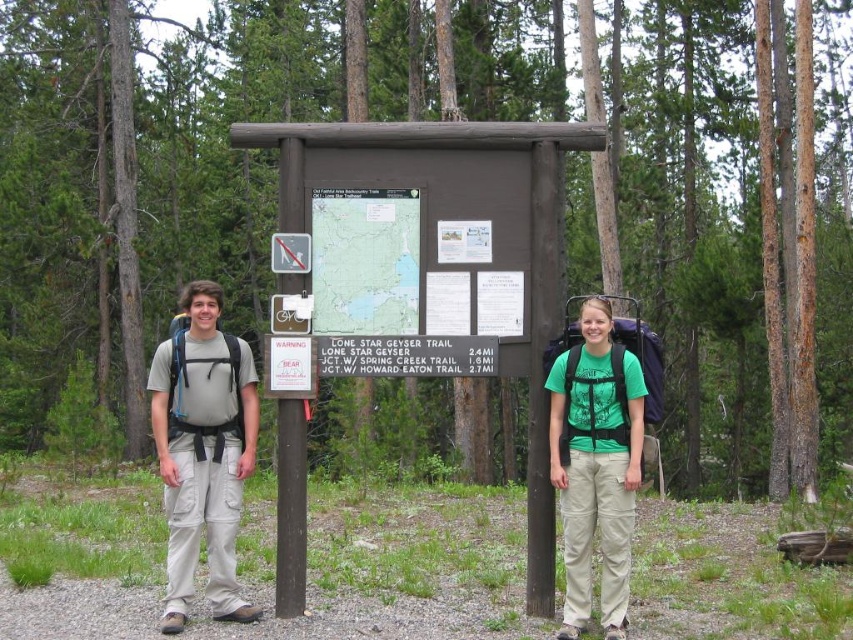
Is point (183, 580) less distant than point (387, 250)?

That is True.

Is matte gray backpack at left further to the viewer compared to paper map at center?

No, matte gray backpack at left is closer to the viewer.

The image size is (853, 640). I want to click on matte gray backpack at left, so click(x=202, y=451).

Can you confirm if matte gray backpack at left is bigger than green cotton t-shirt at center?

Yes, matte gray backpack at left is bigger than green cotton t-shirt at center.

From the picture: Between matte gray backpack at left and green cotton t-shirt at center, which one appears on the left side from the viewer's perspective?

Positioned to the left is green cotton t-shirt at center.

Image resolution: width=853 pixels, height=640 pixels. Describe the element at coordinates (202, 451) in the screenshot. I see `matte gray backpack at left` at that location.

The image size is (853, 640). In order to click on matte gray backpack at left in this screenshot , I will do `click(202, 451)`.

Is point (161, 468) positioned after point (355, 250)?

No, it is in front of (355, 250).

Is green cotton t-shirt at center smaller than paper map at center?

Indeed, green cotton t-shirt at center has a smaller size compared to paper map at center.

Is point (554, 428) positioned before point (335, 298)?

That is True.

The height and width of the screenshot is (640, 853). I want to click on green cotton t-shirt at center, so click(x=291, y=509).